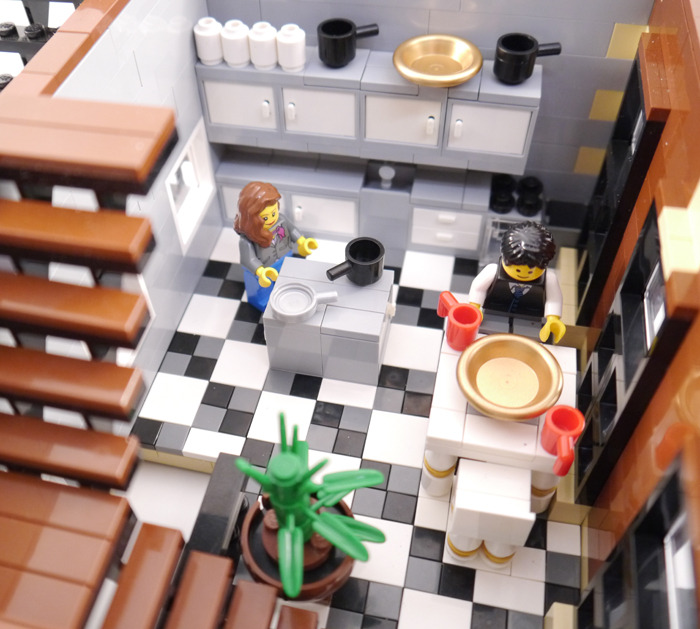
At what (x,y) coordinates should I click in order to perform the action: click on yellow tile on wall. Please return your answer as a coordinate pair (x, y). This screenshot has width=700, height=629. Looking at the image, I should click on (621, 43).